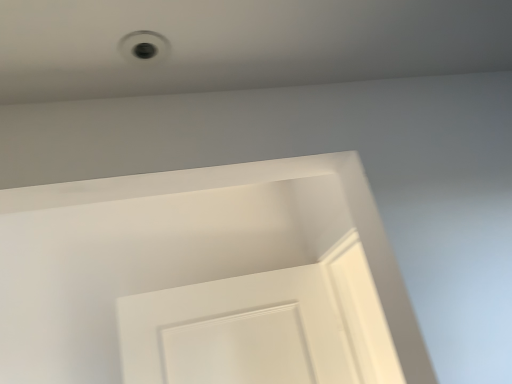
Describe the element at coordinates (144, 48) in the screenshot. I see `white plastic hole at upper center` at that location.

The image size is (512, 384). I want to click on white plastic hole at upper center, so click(x=144, y=48).

What do you see at coordinates (206, 279) in the screenshot?
I see `white matte door at center` at bounding box center [206, 279].

Locate an element on the screen. Image resolution: width=512 pixels, height=384 pixels. white matte door at center is located at coordinates (206, 279).

Measure the distance between white matte door at center and camera.

The distance of white matte door at center from camera is 1.34 meters.

Find the location of `white plastic hole at upper center`. white plastic hole at upper center is located at coordinates (144, 48).

Can you confirm if white plastic hole at upper center is positioned to the right of white matte door at center?

Indeed, white plastic hole at upper center is positioned on the right side of white matte door at center.

Between white plastic hole at upper center and white matte door at center, which one is positioned in front?

white plastic hole at upper center is in front.

Which point is more distant from viewer, (156,46) or (118,257)?

Positioned behind is point (118,257).

Consider the image. From the image's perspective, which is above, white plastic hole at upper center or white matte door at center?

From the image's view, white plastic hole at upper center is above.

From a real-world perspective, relative to white matte door at center, is white plastic hole at upper center vertically above or below?

Clearly, from a real-world perspective, white plastic hole at upper center is above white matte door at center.

Considering the relative sizes of white plastic hole at upper center and white matte door at center in the image provided, is white plastic hole at upper center thinner than white matte door at center?

Correct, the width of white plastic hole at upper center is less than that of white matte door at center.

Is white plastic hole at upper center taller or shorter than white matte door at center?

Considering their sizes, white plastic hole at upper center has less height than white matte door at center.

Can you confirm if white plastic hole at upper center is smaller than white matte door at center?

Indeed, white plastic hole at upper center has a smaller size compared to white matte door at center.

From the picture: Can we say white plastic hole at upper center lies outside white matte door at center?

white plastic hole at upper center lies outside white matte door at center's area.

Are white plastic hole at upper center and white matte door at center located far from each other?

Yes, white plastic hole at upper center is far from white matte door at center.

Could you tell me if white plastic hole at upper center is facing white matte door at center?

No, white plastic hole at upper center is not aimed at white matte door at center.

Identify the location of screen door that appears behind the white plastic hole at upper center. The width and height of the screenshot is (512, 384). (206, 279).

Does white matte door at center appear on the left side of white plastic hole at upper center?

Indeed, white matte door at center is positioned on the left side of white plastic hole at upper center.

Does white matte door at center come in front of white plastic hole at upper center?

No, it is not.

Which is in front, point (311, 257) or point (142, 60)?

The point (142, 60) is in front.

From the image's perspective, relative to white plastic hole at upper center, is white matte door at center above or below?

Clearly, from the image's perspective, white matte door at center is below white plastic hole at upper center.

From a real-world perspective, relative to white plastic hole at upper center, is white matte door at center vertically above or below?

white matte door at center is situated lower than white plastic hole at upper center in the real world.

Based on the photo, considering the sizes of objects white matte door at center and white plastic hole at upper center in the image provided, who is thinner, white matte door at center or white plastic hole at upper center?

white plastic hole at upper center.

Does white matte door at center have a greater height compared to white plastic hole at upper center?

Yes, white matte door at center is taller than white plastic hole at upper center.

In the scene shown: Is white matte door at center smaller than white plastic hole at upper center?

No.

Is white plastic hole at upper center surrounded by white matte door at center?

No, white plastic hole at upper center is not inside white matte door at center.

Is white matte door at center not close to white plastic hole at upper center?

Yes, white matte door at center is far from white plastic hole at upper center.

Is white matte door at center turned away from white plastic hole at upper center?

No, white matte door at center's orientation is not away from white plastic hole at upper center.

How different are the orientations of white matte door at center and white plastic hole at upper center in degrees?

6.55 degrees.

Where is `hole lying on the right of white matte door at center`? hole lying on the right of white matte door at center is located at coordinates (144, 48).

In order to click on screen door below the white plastic hole at upper center (from a real-world perspective) in this screenshot , I will do `click(206, 279)`.

Identify the location of screen door lying behind the white plastic hole at upper center. This screenshot has height=384, width=512. (206, 279).